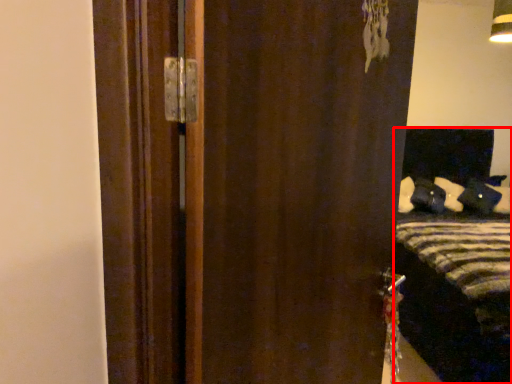
Question: In this image, where is bed (annotated by the red box) located relative to door?

Choices:
 (A) right
 (B) left

Answer: (A)